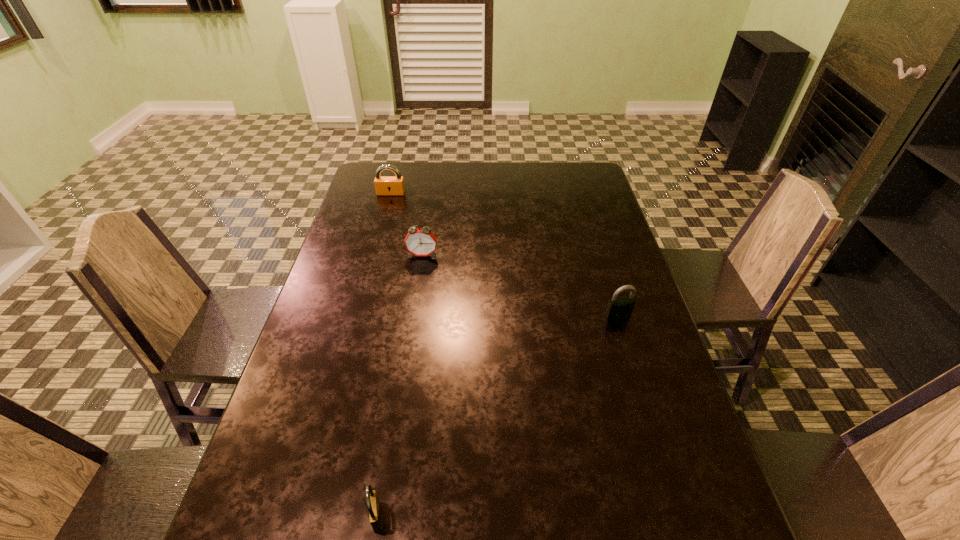
You are a GUI agent. You are given a task and a screenshot of the screen. Output one action in this format:
    pyautogui.click(x=<x>, y=<y>)
    Task: Click on the free space between the second farthest object and the rightmost object
    
    Given the screenshot: What is the action you would take?
    pyautogui.click(x=520, y=285)

Locate an element on the screen. This screenshot has width=960, height=540. vacant space in between the farthest object and the nearest padlock is located at coordinates (384, 355).

Find the location of a particular element. This screenshot has height=540, width=960. free spot between the alarm clock and the second padlock from left to right is located at coordinates (399, 386).

Identify the location of blank region between the nearest object and the second nearest padlock. (497, 416).

Locate an element on the screen. Image resolution: width=960 pixels, height=540 pixels. free space between the second farthest object and the rightmost padlock is located at coordinates (520, 285).

At what (x,y) coordinates should I click in order to perform the action: click on vacant space that's between the leftmost padlock and the third nearest object. Please return your answer as a coordinate pair (x, y). Looking at the image, I should click on (407, 224).

Locate an element on the screen. The width and height of the screenshot is (960, 540). free space between the second nearest object and the third nearest object is located at coordinates (520, 285).

At what (x,y) coordinates should I click in order to perform the action: click on free space that is in between the second farthest padlock and the third nearest object. Please return your answer as a coordinate pair (x, y). Image resolution: width=960 pixels, height=540 pixels. Looking at the image, I should click on (520, 285).

Locate an element on the screen. vacant area that lies between the leftmost object and the nearest object is located at coordinates (384, 355).

Identify which object is the closest to the rightmost padlock. Please provide its 2D coordinates. Your answer should be formatted as a tuple, i.e. [(x, y)], where the tuple contains the x and y coordinates of a point satisfying the conditions above.

[(420, 242)]